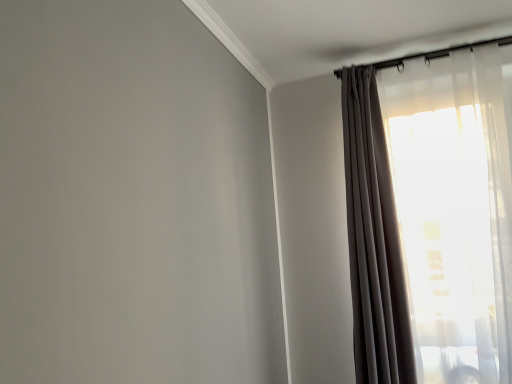
What is the approximate height of matte gray curtain at upper right, the 2th curtain positioned from the right?

The height of matte gray curtain at upper right, the 2th curtain positioned from the right, is 4.85 feet.

Describe the element at coordinates (373, 239) in the screenshot. I see `matte gray curtain at upper right, which is counted as the 1th curtain, starting from the left` at that location.

At what (x,y) coordinates should I click in order to perform the action: click on matte gray curtain at upper right, which is counted as the 1th curtain, starting from the left. Please return your answer as a coordinate pair (x, y). This screenshot has height=384, width=512. Looking at the image, I should click on (373, 239).

Describe the element at coordinates (454, 205) in the screenshot. This screenshot has width=512, height=384. I see `translucent sheer curtain at upper right, arranged as the second curtain when viewed from the left` at that location.

In order to face translucent sheer curtain at upper right, marked as the 1th curtain in a right-to-left arrangement, should I rotate leftwards or rightwards?

A 26.091 degree turn to the right will do.

The height and width of the screenshot is (384, 512). I want to click on translucent sheer curtain at upper right, arranged as the second curtain when viewed from the left, so click(454, 205).

Locate an element on the screen. The height and width of the screenshot is (384, 512). matte gray curtain at upper right, the 2th curtain positioned from the right is located at coordinates (373, 239).

Does matte gray curtain at upper right, the 2th curtain positioned from the right, appear on the left side of translucent sheer curtain at upper right, arranged as the second curtain when viewed from the left?

Yes.

Which object is further away from the camera taking this photo, matte gray curtain at upper right, the 2th curtain positioned from the right, or translucent sheer curtain at upper right, marked as the 1th curtain in a right-to-left arrangement?

translucent sheer curtain at upper right, marked as the 1th curtain in a right-to-left arrangement, is behind.

Considering the points (346, 98) and (438, 289), which point is behind, point (346, 98) or point (438, 289)?

The point (346, 98) is farther.

From the image's perspective, which one is positioned higher, matte gray curtain at upper right, which is counted as the 1th curtain, starting from the left, or translucent sheer curtain at upper right, arranged as the second curtain when viewed from the left?

translucent sheer curtain at upper right, arranged as the second curtain when viewed from the left, appears higher in the image.

From a real-world perspective, is matte gray curtain at upper right, the 2th curtain positioned from the right, located higher than translucent sheer curtain at upper right, arranged as the second curtain when viewed from the left?

No, from a real-world perspective, matte gray curtain at upper right, the 2th curtain positioned from the right, is not above translucent sheer curtain at upper right, arranged as the second curtain when viewed from the left.

Between matte gray curtain at upper right, which is counted as the 1th curtain, starting from the left, and translucent sheer curtain at upper right, arranged as the second curtain when viewed from the left, which one has larger width?

matte gray curtain at upper right, which is counted as the 1th curtain, starting from the left, is wider.

Which of these two, matte gray curtain at upper right, the 2th curtain positioned from the right, or translucent sheer curtain at upper right, marked as the 1th curtain in a right-to-left arrangement, stands taller?

translucent sheer curtain at upper right, marked as the 1th curtain in a right-to-left arrangement, is taller.

Between matte gray curtain at upper right, which is counted as the 1th curtain, starting from the left, and translucent sheer curtain at upper right, marked as the 1th curtain in a right-to-left arrangement, which one has smaller size?

matte gray curtain at upper right, which is counted as the 1th curtain, starting from the left.

Is matte gray curtain at upper right, the 2th curtain positioned from the right, positioned beyond the bounds of translucent sheer curtain at upper right, marked as the 1th curtain in a right-to-left arrangement?

Absolutely, matte gray curtain at upper right, the 2th curtain positioned from the right, is external to translucent sheer curtain at upper right, marked as the 1th curtain in a right-to-left arrangement.

Is matte gray curtain at upper right, which is counted as the 1th curtain, starting from the left, touching translucent sheer curtain at upper right, marked as the 1th curtain in a right-to-left arrangement?

matte gray curtain at upper right, which is counted as the 1th curtain, starting from the left, and translucent sheer curtain at upper right, marked as the 1th curtain in a right-to-left arrangement, are clearly separated.

Is matte gray curtain at upper right, which is counted as the 1th curtain, starting from the left, facing away from translucent sheer curtain at upper right, marked as the 1th curtain in a right-to-left arrangement?

No, matte gray curtain at upper right, which is counted as the 1th curtain, starting from the left, is not facing the opposite direction of translucent sheer curtain at upper right, marked as the 1th curtain in a right-to-left arrangement.

What's the angular difference between matte gray curtain at upper right, the 2th curtain positioned from the right, and translucent sheer curtain at upper right, marked as the 1th curtain in a right-to-left arrangement,'s facing directions?

2.17 degrees separate the facing orientations of matte gray curtain at upper right, the 2th curtain positioned from the right, and translucent sheer curtain at upper right, marked as the 1th curtain in a right-to-left arrangement.

In the scene shown: How far apart are matte gray curtain at upper right, which is counted as the 1th curtain, starting from the left, and translucent sheer curtain at upper right, arranged as the second curtain when viewed from the left?

8.71 inches.

The image size is (512, 384). I want to click on curtain behind the matte gray curtain at upper right, which is counted as the 1th curtain, starting from the left, so click(x=454, y=205).

Which object is positioned more to the left, translucent sheer curtain at upper right, marked as the 1th curtain in a right-to-left arrangement, or matte gray curtain at upper right, the 2th curtain positioned from the right?

From the viewer's perspective, matte gray curtain at upper right, the 2th curtain positioned from the right, appears more on the left side.

Which object is closer to the camera taking this photo, translucent sheer curtain at upper right, arranged as the second curtain when viewed from the left, or matte gray curtain at upper right, the 2th curtain positioned from the right?

Positioned in front is matte gray curtain at upper right, the 2th curtain positioned from the right.

Is point (446, 363) closer or farther from the camera than point (348, 233)?

Point (446, 363).

From the image's perspective, between translucent sheer curtain at upper right, marked as the 1th curtain in a right-to-left arrangement, and matte gray curtain at upper right, the 2th curtain positioned from the right, who is located below?

From the image's view, matte gray curtain at upper right, the 2th curtain positioned from the right, is below.

From a real-world perspective, is translucent sheer curtain at upper right, marked as the 1th curtain in a right-to-left arrangement, located beneath matte gray curtain at upper right, the 2th curtain positioned from the right?

Actually, translucent sheer curtain at upper right, marked as the 1th curtain in a right-to-left arrangement, is physically above matte gray curtain at upper right, the 2th curtain positioned from the right, in the real world.

Considering the sizes of translucent sheer curtain at upper right, arranged as the second curtain when viewed from the left, and matte gray curtain at upper right, the 2th curtain positioned from the right, in the image, is translucent sheer curtain at upper right, arranged as the second curtain when viewed from the left, wider or thinner than matte gray curtain at upper right, the 2th curtain positioned from the right,?

Considering their sizes, translucent sheer curtain at upper right, arranged as the second curtain when viewed from the left, looks slimmer than matte gray curtain at upper right, the 2th curtain positioned from the right.

Who is taller, translucent sheer curtain at upper right, arranged as the second curtain when viewed from the left, or matte gray curtain at upper right, which is counted as the 1th curtain, starting from the left?

translucent sheer curtain at upper right, arranged as the second curtain when viewed from the left.

Based on the photo, between translucent sheer curtain at upper right, arranged as the second curtain when viewed from the left, and matte gray curtain at upper right, which is counted as the 1th curtain, starting from the left, which one has larger size?

translucent sheer curtain at upper right, arranged as the second curtain when viewed from the left.

Is translucent sheer curtain at upper right, arranged as the second curtain when viewed from the left, situated inside matte gray curtain at upper right, the 2th curtain positioned from the right, or outside?

translucent sheer curtain at upper right, arranged as the second curtain when viewed from the left, lies outside matte gray curtain at upper right, the 2th curtain positioned from the right.

Would you consider translucent sheer curtain at upper right, marked as the 1th curtain in a right-to-left arrangement, to be distant from matte gray curtain at upper right, the 2th curtain positioned from the right?

translucent sheer curtain at upper right, marked as the 1th curtain in a right-to-left arrangement, is actually quite close to matte gray curtain at upper right, the 2th curtain positioned from the right.

Is translucent sheer curtain at upper right, marked as the 1th curtain in a right-to-left arrangement, oriented towards matte gray curtain at upper right, which is counted as the 1th curtain, starting from the left?

No, translucent sheer curtain at upper right, marked as the 1th curtain in a right-to-left arrangement, does not turn towards matte gray curtain at upper right, which is counted as the 1th curtain, starting from the left.

Identify the location of curtain that appears above the matte gray curtain at upper right, the 2th curtain positioned from the right (from a real-world perspective). The width and height of the screenshot is (512, 384). (454, 205).

You are a GUI agent. You are given a task and a screenshot of the screen. Output one action in this format:
    pyautogui.click(x=<x>, y=<y>)
    Task: Click on the curtain below the translucent sheer curtain at upper right, marked as the 1th curtain in a right-to-left arrangement (from the image's perspective)
    
    Given the screenshot: What is the action you would take?
    pyautogui.click(x=373, y=239)

Image resolution: width=512 pixels, height=384 pixels. Find the location of `curtain that is under the translucent sheer curtain at upper right, marked as the 1th curtain in a right-to-left arrangement (from a real-world perspective)`. curtain that is under the translucent sheer curtain at upper right, marked as the 1th curtain in a right-to-left arrangement (from a real-world perspective) is located at coordinates (373, 239).